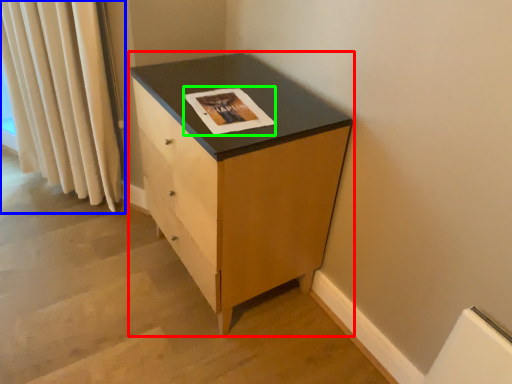
Question: Which object is positioned farthest from chest of drawers (highlighted by a red box)? Select from curtain (highlighted by a blue box) and magazine (highlighted by a green box).

Choices:
 (A) curtain
 (B) magazine

Answer: (A)